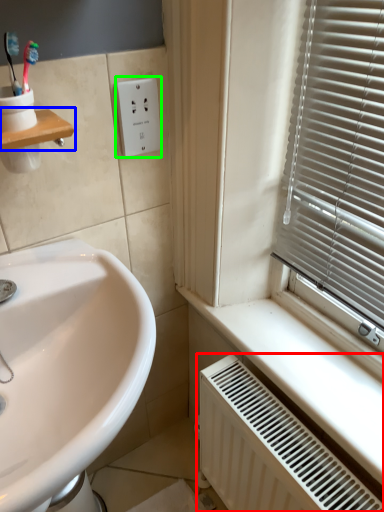
Question: Which object is positioned closest to radiator (highlighted by a red box)? Select from window sill (highlighted by a blue box) and electric outlet (highlighted by a green box).

Choices:
 (A) window sill
 (B) electric outlet

Answer: (B)